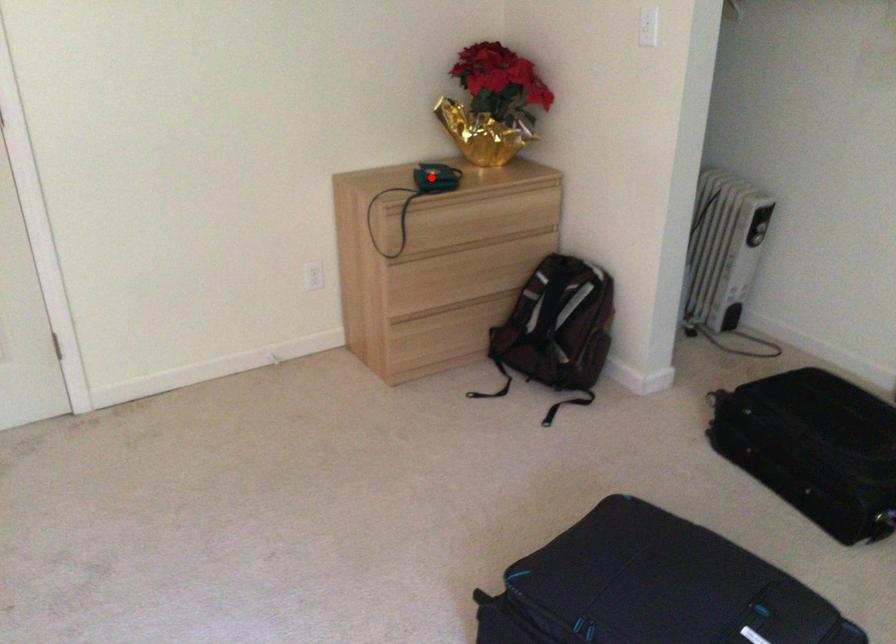
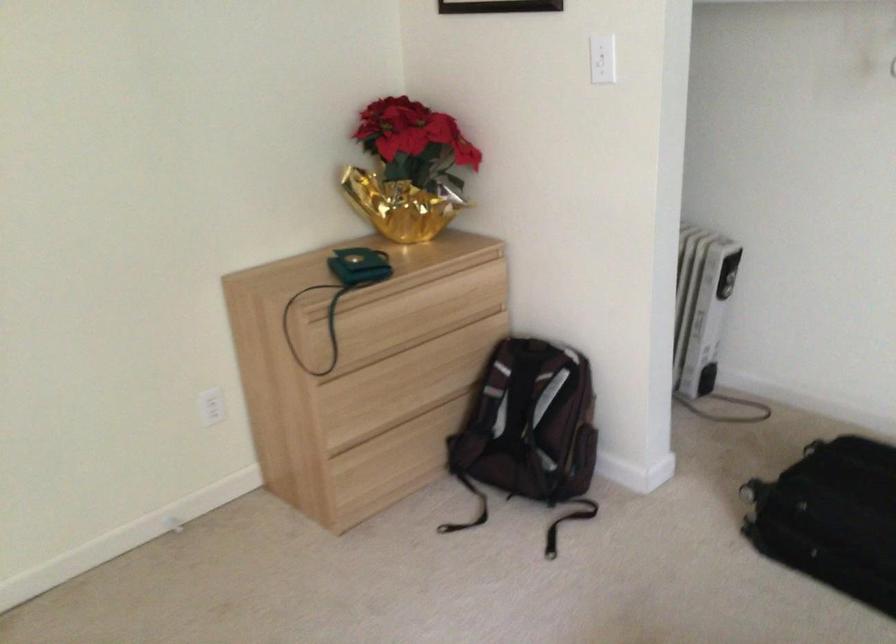
Find the pixel in the second image that matches the highlighted location in the first image.

(358, 267)